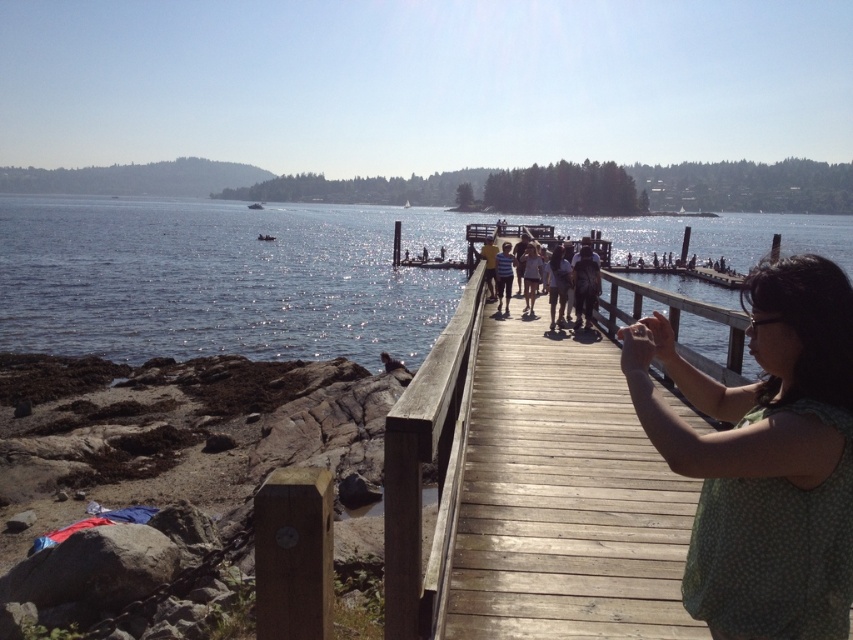
Between glistening water at center and striped shirt at center, which one has less height?

striped shirt at center

Is glistening water at center in front of striped shirt at center?

Yes, glistening water at center is in front of striped shirt at center.

Is point (241, 284) positioned before point (509, 289)?

That is False.

Locate an element on the screen. The image size is (853, 640). glistening water at center is located at coordinates (221, 278).

Does glistening water at center have a larger size compared to matte yellow shirt at center?

Yes, glistening water at center is bigger than matte yellow shirt at center.

Is glistening water at center positioned before matte yellow shirt at center?

Yes, it is in front of matte yellow shirt at center.

Find the location of a particular element. This screenshot has height=640, width=853. glistening water at center is located at coordinates (221, 278).

Is wooden dock at center positioned before striped shirt at center?

Yes, it is in front of striped shirt at center.

Can you confirm if wooden dock at center is shorter than striped shirt at center?

No.

The height and width of the screenshot is (640, 853). Describe the element at coordinates (525, 490) in the screenshot. I see `wooden dock at center` at that location.

The image size is (853, 640). Find the location of `wooden dock at center`. wooden dock at center is located at coordinates (525, 490).